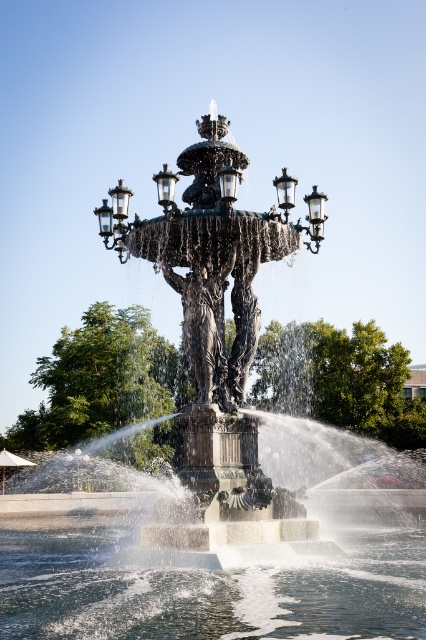
Question: Which object is closer to the camera taking this photo?

Choices:
 (A) clear water at center
 (B) green leafy tree at center
 (C) bronze statue at center

Answer: (A)

Question: Is bronze statue at center to the left of clear water at center from the viewer's perspective?

Choices:
 (A) no
 (B) yes

Answer: (B)

Question: Is clear water at center positioned behind green leafy tree at center?

Choices:
 (A) yes
 (B) no

Answer: (B)

Question: Which object is the farthest from the bronze statue at center?

Choices:
 (A) green leafy tree at center
 (B) clear water at center

Answer: (B)

Question: Considering the real-world distances, which object is closest to the clear water at center?

Choices:
 (A) bronze statue at center
 (B) green leafy tree at center

Answer: (A)

Question: Does bronze statue at center have a larger size compared to clear water at center?

Choices:
 (A) yes
 (B) no

Answer: (A)